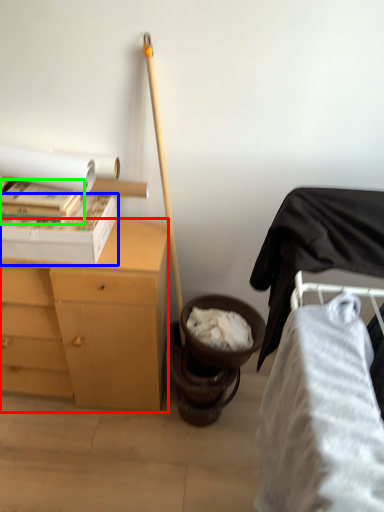
Question: Based on their relative distances, which object is nearer to desk (highlighted by a red box)? Choose from box (highlighted by a blue box) and book (highlighted by a green box).

Choices:
 (A) box
 (B) book

Answer: (A)